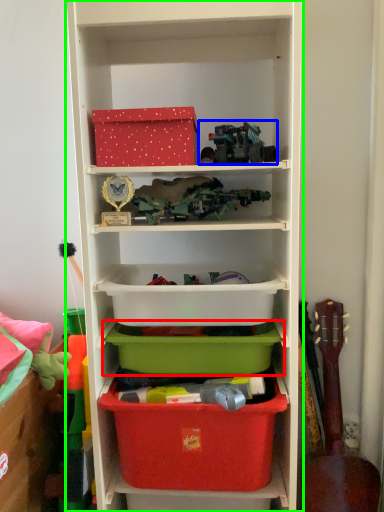
Question: Estimate the real-world distances between objects in this image. Which object is farther from storage box (highlighted by a red box), toy (highlighted by a blue box) or shelf (highlighted by a green box)?

Choices:
 (A) toy
 (B) shelf

Answer: (A)